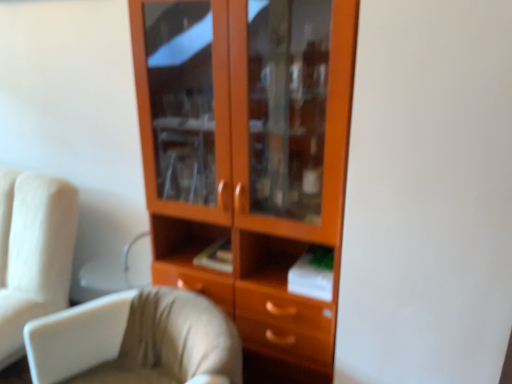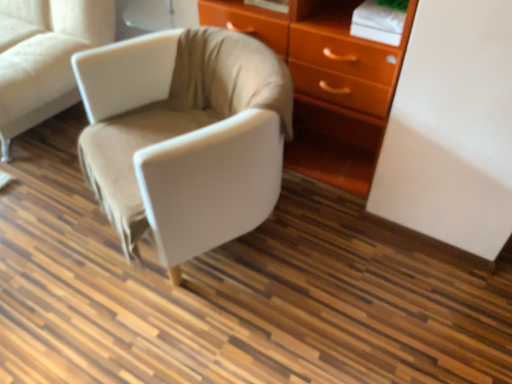
Question: Which way did the camera rotate in the video?

Choices:
 (A) rotated right
 (B) rotated left

Answer: (B)